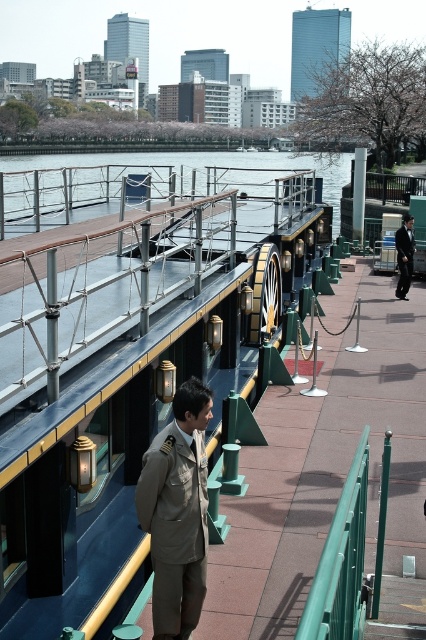
Between point (164, 435) and point (408, 273), which one is positioned in front?

Point (164, 435)

Which is above, khaki fabric trench coat at center or black suit at center?

black suit at center is higher up.

Does point (146, 518) come farther from viewer compared to point (402, 221)?

No, it is in front of (402, 221).

Image resolution: width=426 pixels, height=640 pixels. I want to click on khaki fabric trench coat at center, so click(175, 528).

Does blue polished wood boat at center have a lesser height compared to black suit at center?

Incorrect, blue polished wood boat at center's height does not fall short of black suit at center's.

Is point (92, 328) behind point (403, 253)?

No, (92, 328) is closer to viewer.

Where is `blue polished wood boat at center`? The image size is (426, 640). blue polished wood boat at center is located at coordinates (127, 369).

Which is below, blue polished wood boat at center or khaki fabric trench coat at center?

khaki fabric trench coat at center

Is blue polished wood boat at center positioned in front of khaki fabric trench coat at center?

Yes, it is in front of khaki fabric trench coat at center.

Which is in front, point (290, 177) or point (184, 484)?

Point (184, 484) is in front.

Find the location of a particular element. The height and width of the screenshot is (640, 426). blue polished wood boat at center is located at coordinates click(x=127, y=369).